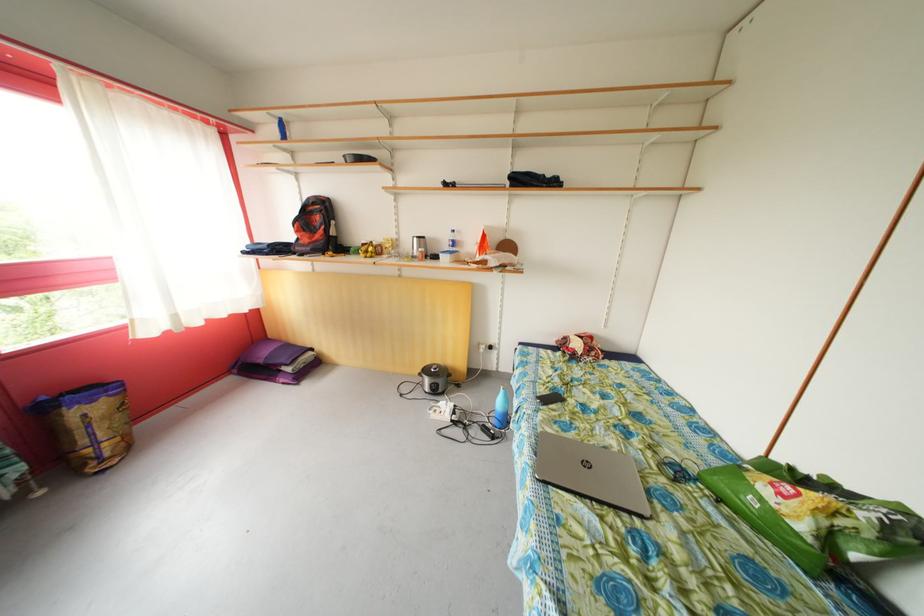
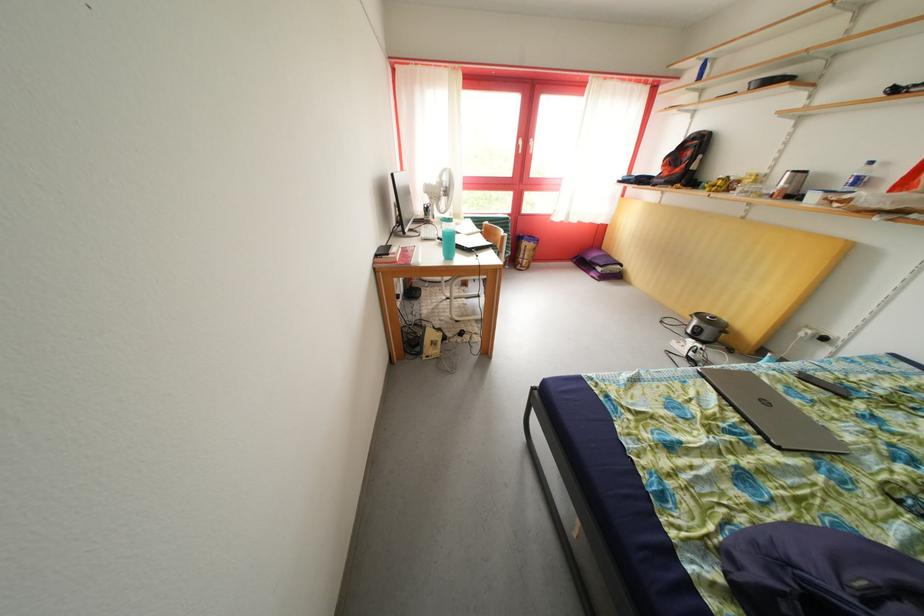
The point at (297, 375) is marked in the first image. Where is the corresponding point in the second image?

(608, 275)